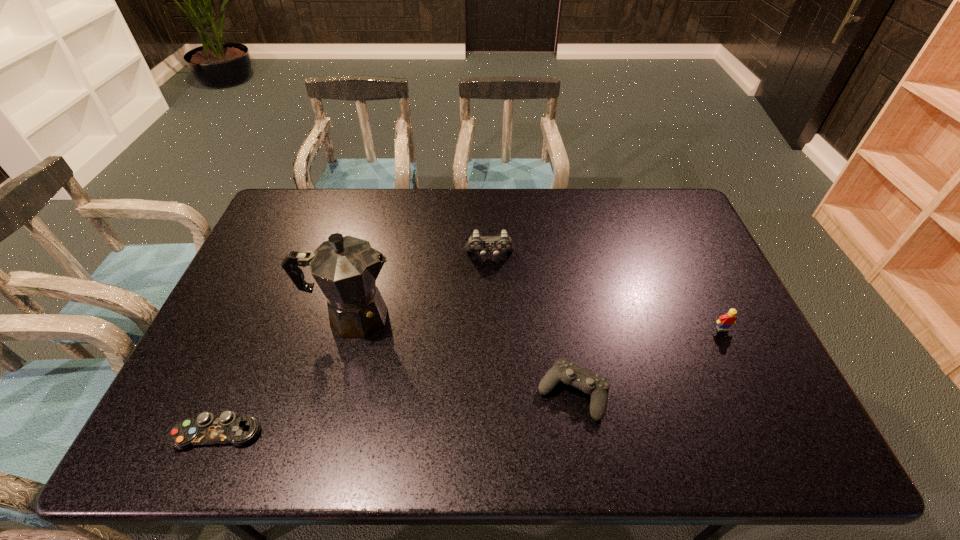
Where is `free space located 0.220m on the pouring side of the coffeepot`? The image size is (960, 540). free space located 0.220m on the pouring side of the coffeepot is located at coordinates (478, 317).

You are a GUI agent. You are given a task and a screenshot of the screen. Output one action in this format:
    pyautogui.click(x=<x>, y=<y>)
    Task: Click on the vacant area situated on the surface of the third object from left to right with buttons
    This screenshot has height=540, width=960.
    Given the screenshot: What is the action you would take?
    click(x=491, y=302)

This screenshot has width=960, height=540. Find the location of `free space located 0.230m on the front-facing side of the Lego`. free space located 0.230m on the front-facing side of the Lego is located at coordinates (760, 409).

Where is `vacant position located 0.150m on the back of the second shortest control`? This screenshot has width=960, height=540. vacant position located 0.150m on the back of the second shortest control is located at coordinates (561, 319).

The image size is (960, 540). I want to click on free space located on the back of the shortest control, so click(x=240, y=383).

Image resolution: width=960 pixels, height=540 pixels. I want to click on object present at the left edge, so click(227, 428).

Identify the location of object located at the right edge. The width and height of the screenshot is (960, 540). (725, 321).

Locate an element on the screen. object that is at the near left corner is located at coordinates click(227, 428).

The height and width of the screenshot is (540, 960). What are the coordinates of `free space at the far edge of the desktop` in the screenshot? It's located at (337, 206).

The height and width of the screenshot is (540, 960). What are the coordinates of `free location at the near edge` in the screenshot? It's located at (355, 453).